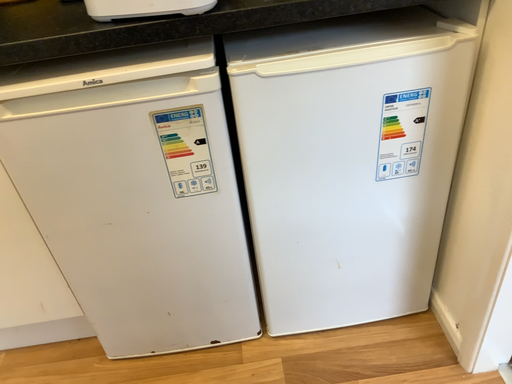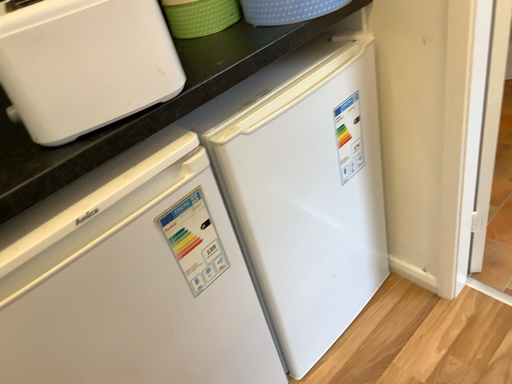
Question: Which way did the camera rotate in the video?

Choices:
 (A) rotated left
 (B) rotated right

Answer: (B)